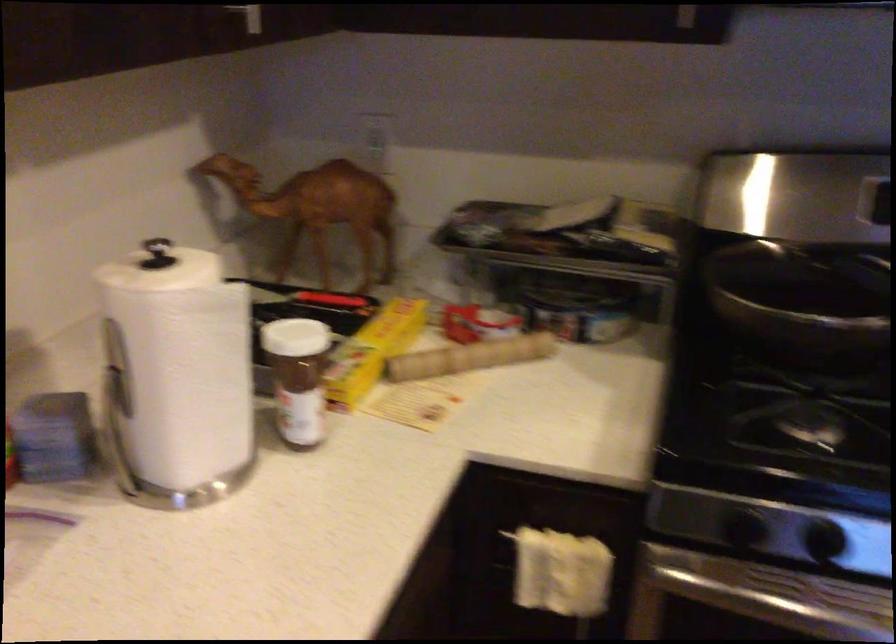
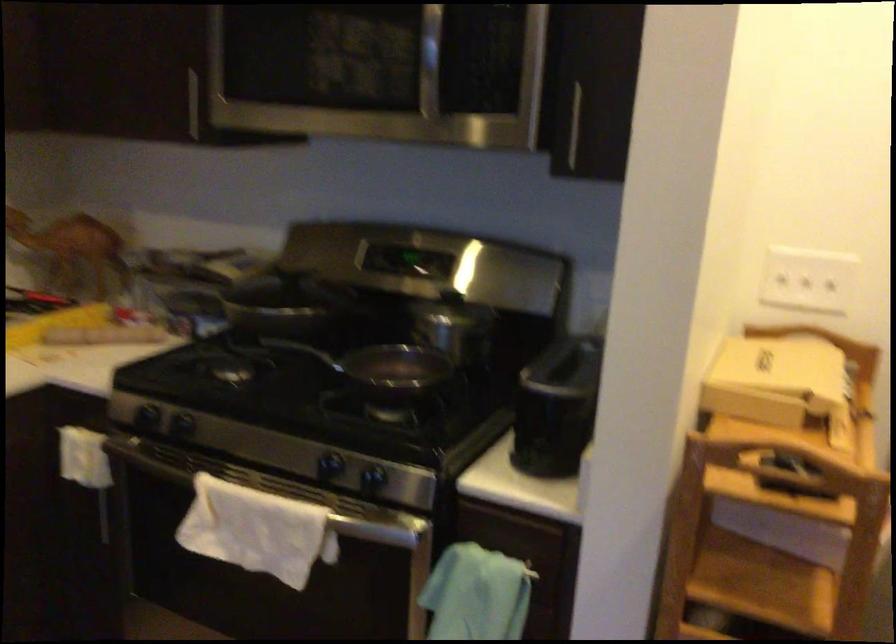
In a continuous first-person perspective shot, in which direction is the camera moving?

The cameraman moved toward right, backward.